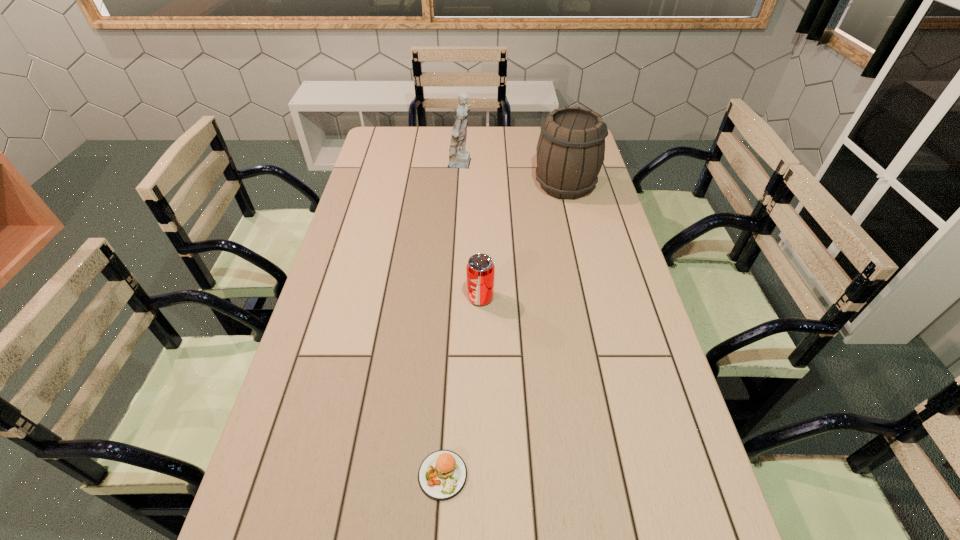
Identify the location of object at the right edge. Image resolution: width=960 pixels, height=540 pixels. (571, 148).

The width and height of the screenshot is (960, 540). I want to click on vacant space at the far edge of the desktop, so click(x=503, y=154).

Where is `vacant area at the left edge`? Image resolution: width=960 pixels, height=540 pixels. vacant area at the left edge is located at coordinates (351, 316).

The width and height of the screenshot is (960, 540). What are the coordinates of `blank area at the right edge` in the screenshot? It's located at (620, 251).

You are a GUI agent. You are given a task and a screenshot of the screen. Output one action in this format:
    pyautogui.click(x=<x>, y=<y>)
    Task: Click on the blank region between the figurine and the soda can
    
    Given the screenshot: What is the action you would take?
    pyautogui.click(x=471, y=231)

Locate an element on the screen. This screenshot has width=960, height=540. free space between the second nearest object and the figurine is located at coordinates (471, 231).

Find the location of a particular element. Image resolution: width=960 pixels, height=540 pixels. free area in between the rightmost object and the figurine is located at coordinates (514, 175).

Find the location of a particular element. This screenshot has height=540, width=960. free spot between the rightmost object and the figurine is located at coordinates (514, 175).

Find the location of a particular element. This screenshot has width=960, height=540. blank region between the wine bucket and the figurine is located at coordinates (514, 175).

Image resolution: width=960 pixels, height=540 pixels. Find the location of `free space that is in between the nearest object and the figurine`. free space that is in between the nearest object and the figurine is located at coordinates point(453,320).